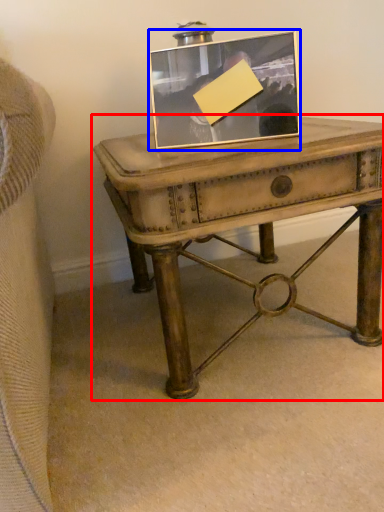
Question: Which object appears farthest to the camera in this image, table (highlighted by a red box) or picture frame (highlighted by a blue box)?

Choices:
 (A) table
 (B) picture frame

Answer: (B)